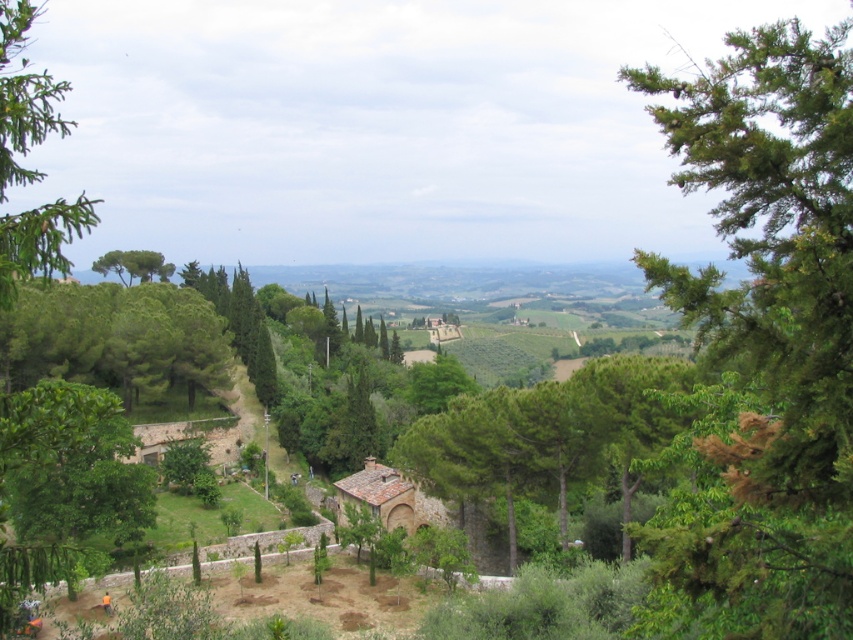
Question: Can you confirm if green leafy tree at right is thinner than green needle-like at left?

Choices:
 (A) no
 (B) yes

Answer: (B)

Question: Which point is farther to the camera?

Choices:
 (A) green needle-like at left
 (B) green leafy tree at right

Answer: (A)

Question: Which point is farther from the camera taking this photo?

Choices:
 (A) (47, 211)
 (B) (704, 179)

Answer: (A)

Question: Does green leafy tree at right appear under green needle-like at left?

Choices:
 (A) yes
 (B) no

Answer: (A)

Question: Is the position of green leafy tree at right less distant than that of green needle-like at left?

Choices:
 (A) no
 (B) yes

Answer: (B)